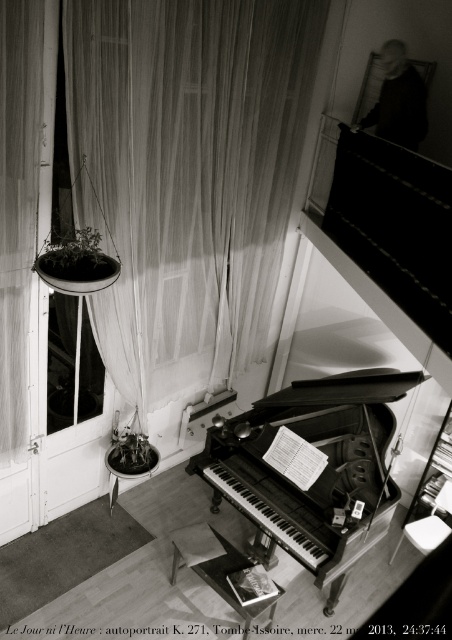
You are standing in the room looking at the grand piano. There are two points marked on the floor at coordinates point (269,538) and point (85,362). If you were to walk from the grand piano towards the entrance of the room, which point would you pass over first?

Point (269,538) is in front of point (85,362), so you would pass over point (269,538) first when walking from the grand piano towards the entrance.